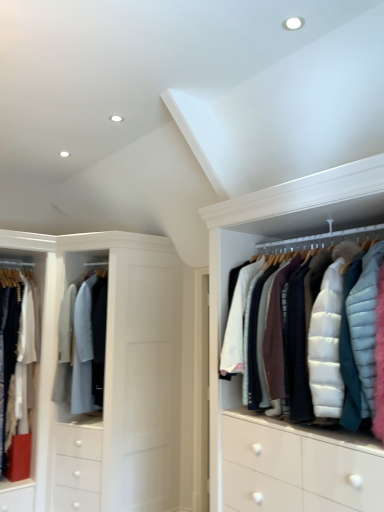
Question: Considering the relative positions of light gray wool coat at center, placed as the 1th clothing when sorted from right to left, and white cotton shirt at left, the second clothing in the right-to-left sequence, in the image provided, is light gray wool coat at center, placed as the 1th clothing when sorted from right to left, behind white cotton shirt at left, the second clothing in the right-to-left sequence,?

Choices:
 (A) yes
 (B) no

Answer: (A)

Question: Is light gray wool coat at center, positioned as the 2th clothing in left-to-right order, wider than white cotton shirt at left, the second clothing in the right-to-left sequence?

Choices:
 (A) no
 (B) yes

Answer: (B)

Question: Is light gray wool coat at center, positioned as the 2th clothing in left-to-right order, at the right side of white cotton shirt at left, the second clothing in the right-to-left sequence?

Choices:
 (A) yes
 (B) no

Answer: (A)

Question: Is light gray wool coat at center, placed as the 1th clothing when sorted from right to left, not within white cotton shirt at left, the second clothing in the right-to-left sequence?

Choices:
 (A) yes
 (B) no

Answer: (A)

Question: From the image's perspective, is light gray wool coat at center, placed as the 1th clothing when sorted from right to left, located above white cotton shirt at left, the second clothing in the right-to-left sequence?

Choices:
 (A) yes
 (B) no

Answer: (A)

Question: Is light gray wool coat at center, positioned as the 2th clothing in left-to-right order, wider or thinner than white puffy jacket at upper right?

Choices:
 (A) wide
 (B) thin

Answer: (A)

Question: Looking at the image, does light gray wool coat at center, positioned as the 2th clothing in left-to-right order, seem bigger or smaller compared to white puffy jacket at upper right?

Choices:
 (A) small
 (B) big

Answer: (A)

Question: From the image's perspective, is light gray wool coat at center, placed as the 1th clothing when sorted from right to left, positioned above or below white puffy jacket at upper right?

Choices:
 (A) below
 (B) above

Answer: (A)

Question: Visually, is light gray wool coat at center, positioned as the 2th clothing in left-to-right order, positioned to the left or to the right of white puffy jacket at upper right?

Choices:
 (A) right
 (B) left

Answer: (B)

Question: From a real-world perspective, is white puffy jacket at upper right physically located above or below white cotton shirt at left, the 1th clothing from the left?

Choices:
 (A) above
 (B) below

Answer: (A)

Question: Is white puffy jacket at upper right bigger or smaller than white cotton shirt at left, the second clothing in the right-to-left sequence?

Choices:
 (A) small
 (B) big

Answer: (B)

Question: Visually, is white puffy jacket at upper right positioned to the left or to the right of white cotton shirt at left, the second clothing in the right-to-left sequence?

Choices:
 (A) right
 (B) left

Answer: (A)

Question: Does point (288, 271) appear closer or farther from the camera than point (9, 428)?

Choices:
 (A) farther
 (B) closer

Answer: (B)

Question: In terms of width, does white puffy jacket at upper right look wider or thinner when compared to light gray wool coat at center, placed as the 1th clothing when sorted from right to left?

Choices:
 (A) thin
 (B) wide

Answer: (A)

Question: Does point [294, 278] appear closer or farther from the camera than point [87, 305]?

Choices:
 (A) closer
 (B) farther

Answer: (A)